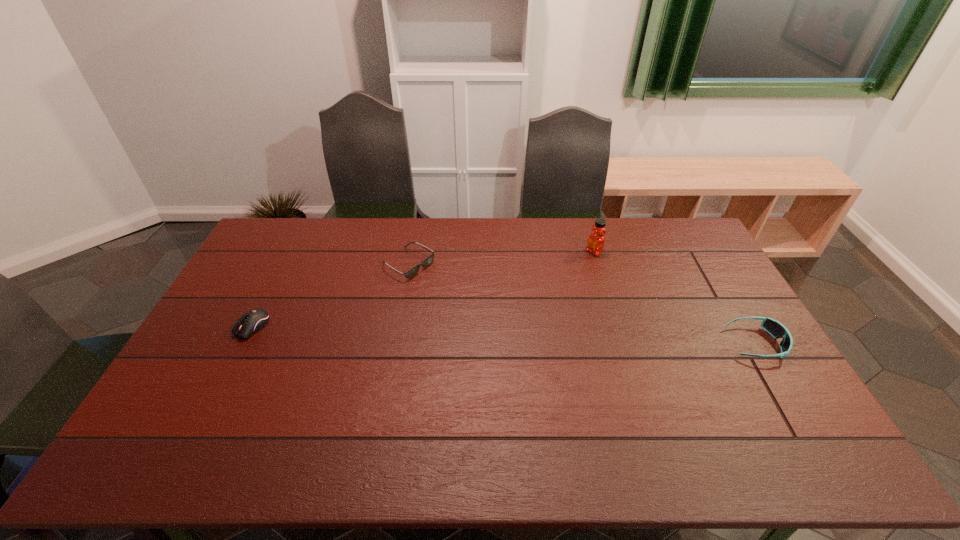
Where is `free space located 0.130m on the front label of the tallest object`? This screenshot has width=960, height=540. free space located 0.130m on the front label of the tallest object is located at coordinates (564, 269).

The image size is (960, 540). I want to click on vacant point located 0.270m on the front-facing side of the second object from left to right, so click(489, 310).

Locate an element on the screen. vacant space located 0.150m on the front-facing side of the second object from left to right is located at coordinates (460, 294).

Where is `free space located on the front-facing side of the second object from left to right`? Image resolution: width=960 pixels, height=540 pixels. free space located on the front-facing side of the second object from left to right is located at coordinates (501, 318).

You are a GUI agent. You are given a task and a screenshot of the screen. Output one action in this format:
    pyautogui.click(x=<x>, y=<y>)
    Task: Click on the honey that is at the far edge
    The height and width of the screenshot is (540, 960).
    Given the screenshot: What is the action you would take?
    pyautogui.click(x=596, y=241)

Where is `sunglasses that is positioned at the far edge`? This screenshot has height=540, width=960. sunglasses that is positioned at the far edge is located at coordinates (413, 271).

Find the location of a particular element. object at the left edge is located at coordinates (254, 320).

This screenshot has width=960, height=540. Identify the location of object at the right edge. (777, 330).

Image resolution: width=960 pixels, height=540 pixels. What are the coordinates of `vacant space at the far edge of the desktop` in the screenshot? It's located at (331, 233).

Where is `free point at the near edge`? Image resolution: width=960 pixels, height=540 pixels. free point at the near edge is located at coordinates (709, 399).